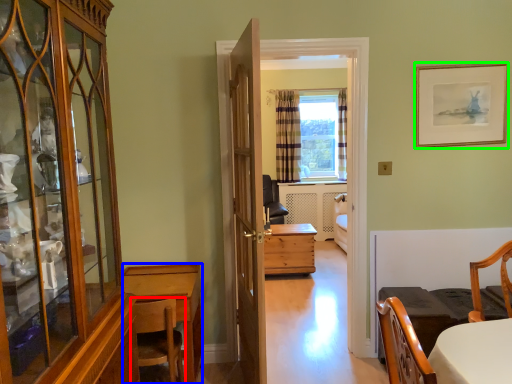
Question: Which is farther away from chair (highlighted by a red box)? desk (highlighted by a blue box) or picture frame (highlighted by a green box)?

Choices:
 (A) desk
 (B) picture frame

Answer: (B)